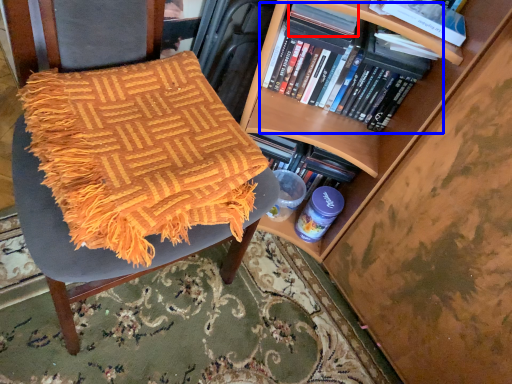
Question: Which of the following is the closest to the observer, paperback book (highlighted by a red box) or book (highlighted by a blue box)?

Choices:
 (A) paperback book
 (B) book

Answer: (A)